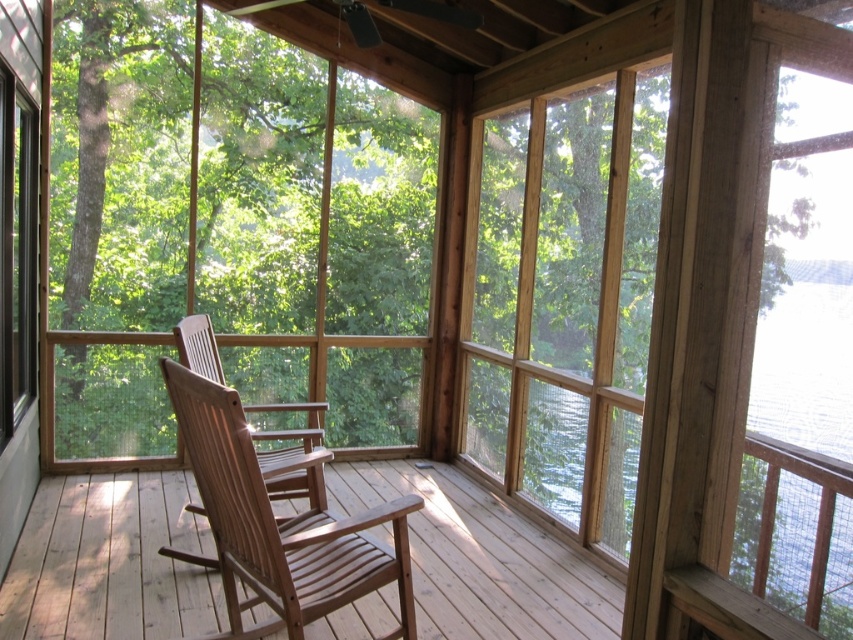
You are standing on the wooden flooring of the porch and see two points marked on the floor. Which point is closer to you, point (415, 352) or point (204, 451)?

Point (415, 352) is closer to you because it is further to the viewer than point (204, 451).

You are sitting on the light brown wooden rocking chair at center and want to pour water from the clear glass water at right into a cup. Can you reach it without moving from your current position?

The light brown wooden rocking chair at center is in front of clear glass water at right, so you are closer to the clear glass water at right. Therefore, you can likely reach it without moving from your current position.

You are standing on the wooden floor of the porch and see two points marked on the wall. The first point is at coordinates point (202, 557) and the second point is at point (840, 476). Which point is closer to you?

Point (202, 557) is closer to you because it is further to the viewer than point (840, 476).